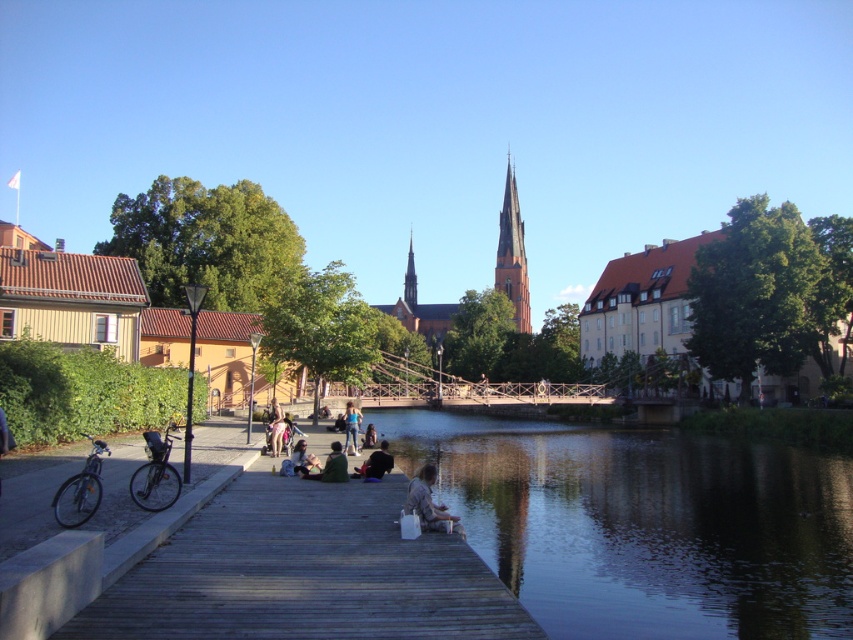
Is dark reflective water at lower center further to the viewer compared to light brown wooden bench at lower center?

No, it is in front of light brown wooden bench at lower center.

What do you see at coordinates (643, 524) in the screenshot? I see `dark reflective water at lower center` at bounding box center [643, 524].

The image size is (853, 640). In order to click on dark reflective water at lower center in this screenshot , I will do `click(643, 524)`.

Who is higher up, light brown wooden bench at lower center or light brown leather jacket at center?

light brown wooden bench at lower center is above.

Between light brown wooden bench at lower center and light brown leather jacket at center, which one appears on the left side from the viewer's perspective?

light brown wooden bench at lower center is more to the left.

Where is `light brown wooden bench at lower center`? This screenshot has width=853, height=640. light brown wooden bench at lower center is located at coordinates (274, 428).

Does wooden dock at lower center have a greater height compared to red brick spire at center?

Yes.

Is wooden dock at lower center positioned at the back of red brick spire at center?

No, wooden dock at lower center is closer to the viewer.

Where is `wooden dock at lower center`? This screenshot has height=640, width=853. wooden dock at lower center is located at coordinates (192, 244).